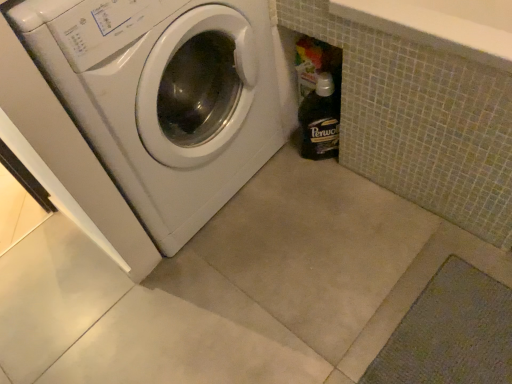
Question: In the image, is black glass bottle at lower right on the left side or the right side of white glossy washing machine at left?

Choices:
 (A) left
 (B) right

Answer: (B)

Question: In terms of width, does black glass bottle at lower right look wider or thinner when compared to white glossy washing machine at left?

Choices:
 (A) wide
 (B) thin

Answer: (B)

Question: Is point (329, 97) closer or farther from the camera than point (158, 125)?

Choices:
 (A) closer
 (B) farther

Answer: (B)

Question: Is white glossy washing machine at left inside the boundaries of black glass bottle at lower right, or outside?

Choices:
 (A) inside
 (B) outside

Answer: (B)

Question: Considering the positions of point (266, 134) and point (318, 150), is point (266, 134) closer or farther from the camera than point (318, 150)?

Choices:
 (A) farther
 (B) closer

Answer: (B)

Question: Is white glossy washing machine at left taller or shorter than black glass bottle at lower right?

Choices:
 (A) short
 (B) tall

Answer: (B)

Question: Considering their positions, is white glossy washing machine at left located in front of or behind black glass bottle at lower right?

Choices:
 (A) behind
 (B) front

Answer: (B)